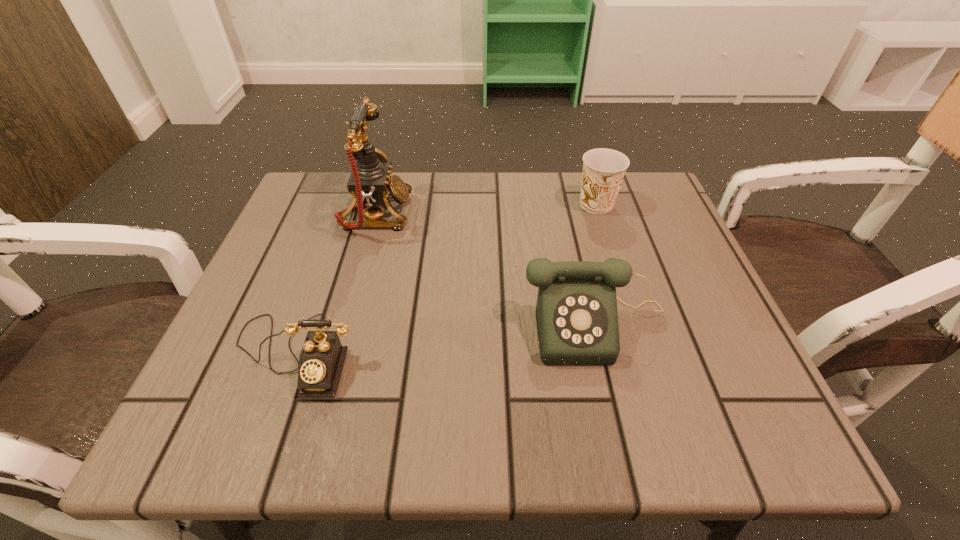
I want to click on the farthest telephone, so click(x=370, y=183).

At what (x,y) coordinates should I click in order to perform the action: click on the tallest telephone. Please return your answer as a coordinate pair (x, y). The image size is (960, 540). Looking at the image, I should click on (370, 183).

This screenshot has height=540, width=960. What are the coordinates of `the rightmost telephone` in the screenshot? It's located at (576, 312).

The image size is (960, 540). I want to click on Dixie cup, so click(x=603, y=169).

Where is `the shortest object`? the shortest object is located at coordinates (322, 357).

Image resolution: width=960 pixels, height=540 pixels. In order to click on vacant position located on the front of the farthest telephone, featuring the rotary dial in this screenshot , I will do `click(531, 214)`.

Locate an element on the screen. free space located on the dial of the rightmost telephone is located at coordinates 621,432.

The width and height of the screenshot is (960, 540). I want to click on vacant space located 0.360m on the left of the Dixie cup, so click(419, 205).

Identify the location of telephone located in the far edge section of the desktop. Image resolution: width=960 pixels, height=540 pixels. (370, 183).

Where is `Dixie cup that is at the far edge`? This screenshot has height=540, width=960. Dixie cup that is at the far edge is located at coordinates (603, 169).